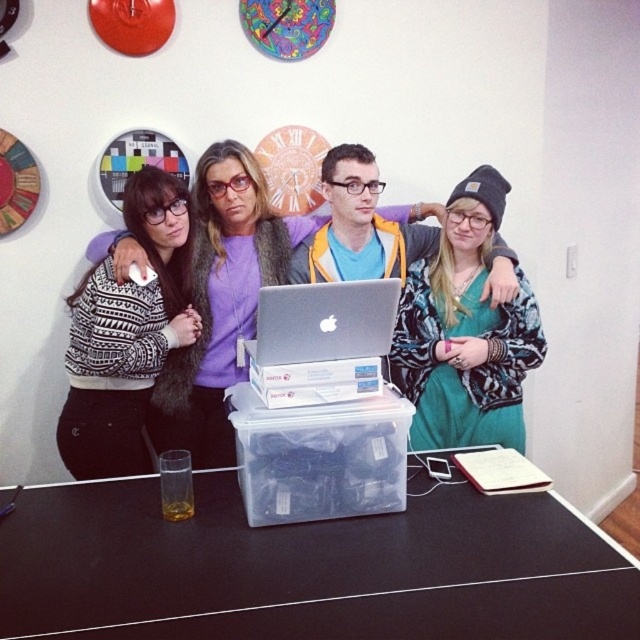
Does black plastic table at center appear on the right side of black knit beanie at upper right?

Incorrect, black plastic table at center is not on the right side of black knit beanie at upper right.

Who is lower down, black plastic table at center or black knit beanie at upper right?

black plastic table at center is below.

You are a GUI agent. You are given a task and a screenshot of the screen. Output one action in this format:
    pyautogui.click(x=<x>, y=<y>)
    Task: Click on the black plastic table at center
    The height and width of the screenshot is (640, 640).
    Given the screenshot: What is the action you would take?
    pyautogui.click(x=307, y=570)

Image resolution: width=640 pixels, height=640 pixels. I want to click on black plastic table at center, so click(307, 570).

Which is more to the left, black knit beanie at upper right or silver metallic laptop at center?

From the viewer's perspective, silver metallic laptop at center appears more on the left side.

Between black knit beanie at upper right and silver metallic laptop at center, which one has less height?

silver metallic laptop at center

Who is more forward, (x=483, y=198) or (x=381, y=330)?

Point (x=381, y=330) is in front.

The width and height of the screenshot is (640, 640). In order to click on black knit beanie at upper right in this screenshot , I will do `click(465, 332)`.

Is white printed sweater at left thinner than silver metallic laptop at center?

No.

Does white printed sweater at left appear over silver metallic laptop at center?

No.

You are a GUI agent. You are given a task and a screenshot of the screen. Output one action in this format:
    pyautogui.click(x=<x>, y=<y>)
    Task: Click on the white printed sweater at left
    The height and width of the screenshot is (640, 640).
    Given the screenshot: What is the action you would take?
    pyautogui.click(x=125, y=333)